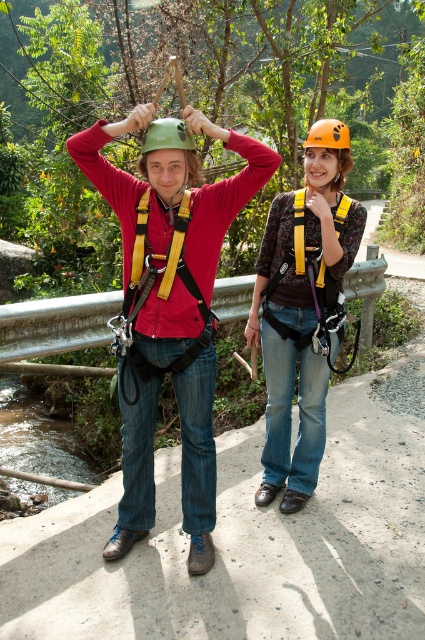
Question: Is matte green helmet at upper left closer to camera compared to orange matte helmet at upper center?

Choices:
 (A) yes
 (B) no

Answer: (A)

Question: Can you confirm if matte green helmet at upper left is thinner than orange matte helmet at upper center?

Choices:
 (A) yes
 (B) no

Answer: (B)

Question: Which of the following is the farthest from the observer?

Choices:
 (A) orange matte helmet at upper center
 (B) matte green helmet at upper left
 (C) green matte helmet at center
 (D) matte orange helmet at center

Answer: (A)

Question: Does matte orange helmet at center appear on the left side of orange matte helmet at upper center?

Choices:
 (A) no
 (B) yes

Answer: (B)

Question: Which point is farther from the camera taking this photo?

Choices:
 (A) (328, 120)
 (B) (189, 396)
 (C) (198, 164)

Answer: (A)

Question: Which point is closer to the camera taking this photo?

Choices:
 (A) (345, 125)
 (B) (180, 321)

Answer: (B)